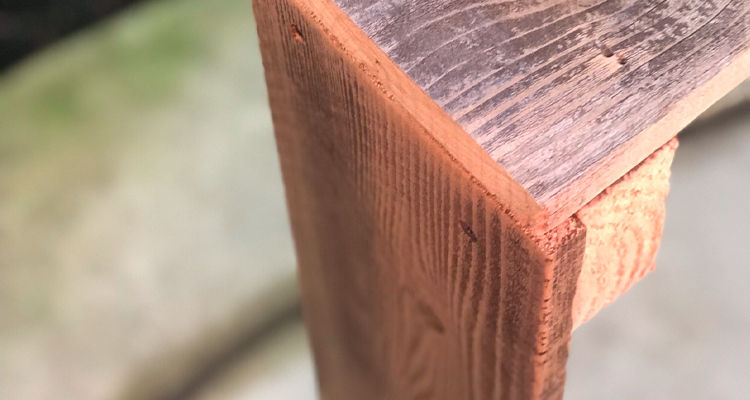
Where is `background blurry wooden floor to right of foreground image`? The image size is (750, 400). background blurry wooden floor to right of foreground image is located at coordinates (712, 312).